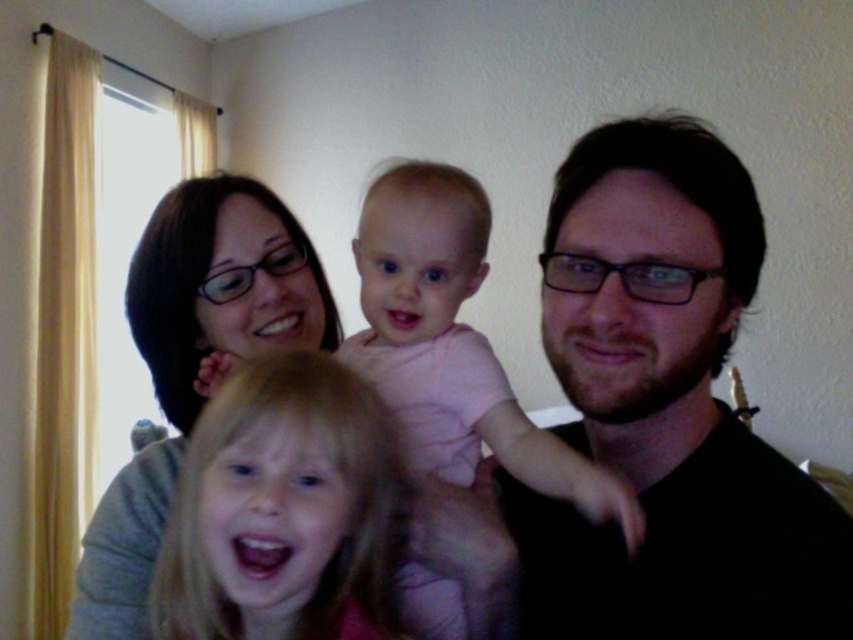
You are a photographer trying to capture a closeup of the blonde hair at center and the pink fabric baby at center in the living room scene. Since you want to ensure both subjects are in focus, which subject should you adjust your camera focus to prioritize based on their sizes?

The blonde hair at center has a lesser width compared to pink fabric baby at center, so you should prioritize focusing on the pink fabric baby at center since it is larger and requires more precise focus to ensure clarity.

In the living room scene, you see a woman holding a baby and someone with blonde hair at center and pink fabric baby at center. Which object is positioned to the left?

The blonde hair at center is to the left of the pink fabric baby at center.